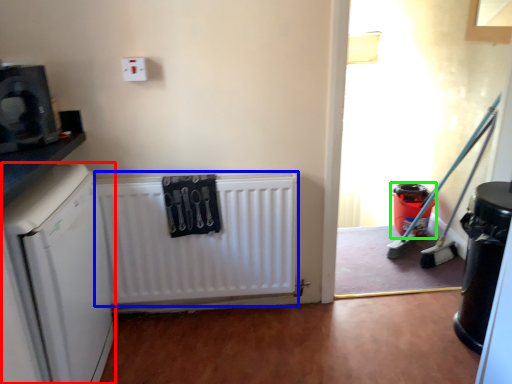
Question: Estimate the real-world distances between objects in this image. Which object is farther from dish washer (highlighted by a red box), radiator (highlighted by a blue box) or appliance (highlighted by a green box)?

Choices:
 (A) radiator
 (B) appliance

Answer: (B)